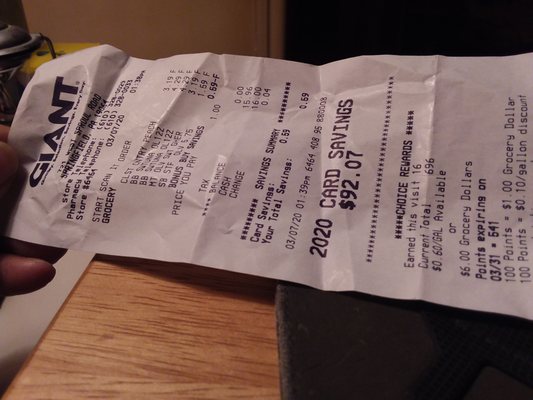
This screenshot has width=533, height=400. Find the location of `table`. table is located at coordinates (180, 333).